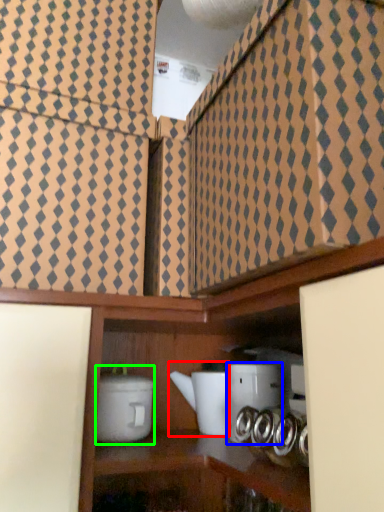
Question: Which object is the farthest from appliance (highlighted by a red box)? Choose among these: appliance (highlighted by a blue box) or appliance (highlighted by a green box).

Choices:
 (A) appliance
 (B) appliance

Answer: (B)